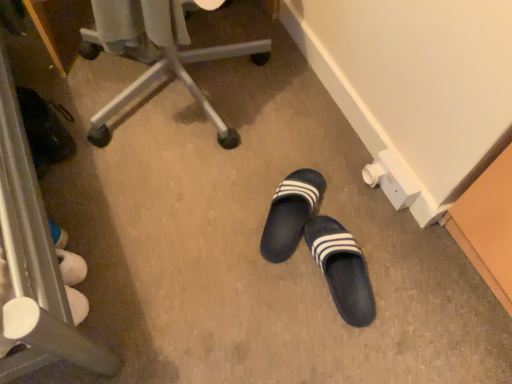
Question: Is black rubber slippers at center, the 1th footwear when ordered from left to right, not near black rubber slippers at center, the 2th footwear positioned from the left?

Choices:
 (A) no
 (B) yes

Answer: (A)

Question: Is black rubber slippers at center, the second footwear in the right-to-left sequence, closer to camera compared to black rubber slippers at center, the 1th footwear when ordered from right to left?

Choices:
 (A) no
 (B) yes

Answer: (A)

Question: Is black rubber slippers at center, the second footwear in the right-to-left sequence, wider than black rubber slippers at center, the 1th footwear when ordered from right to left?

Choices:
 (A) yes
 (B) no

Answer: (A)

Question: From a real-world perspective, is black rubber slippers at center, the second footwear in the right-to-left sequence, over black rubber slippers at center, the 1th footwear when ordered from right to left?

Choices:
 (A) no
 (B) yes

Answer: (B)

Question: From a real-world perspective, is black rubber slippers at center, the second footwear in the right-to-left sequence, located beneath black rubber slippers at center, the 1th footwear when ordered from right to left?

Choices:
 (A) yes
 (B) no

Answer: (B)

Question: In terms of width, does black rubber slippers at center, the 2th footwear positioned from the left, look wider or thinner when compared to matte plastic chair at upper center?

Choices:
 (A) wide
 (B) thin

Answer: (B)

Question: Choose the correct answer: Is black rubber slippers at center, the 2th footwear positioned from the left, inside matte plastic chair at upper center or outside it?

Choices:
 (A) outside
 (B) inside

Answer: (A)

Question: Considering the positions of black rubber slippers at center, the 2th footwear positioned from the left, and matte plastic chair at upper center in the image, is black rubber slippers at center, the 2th footwear positioned from the left, bigger or smaller than matte plastic chair at upper center?

Choices:
 (A) small
 (B) big

Answer: (A)

Question: Considering the relative positions of black rubber slippers at center, the 1th footwear when ordered from right to left, and matte plastic chair at upper center in the image provided, is black rubber slippers at center, the 1th footwear when ordered from right to left, to the left or to the right of matte plastic chair at upper center?

Choices:
 (A) right
 (B) left

Answer: (A)

Question: From a real-world perspective, is black rubber slippers at center, the second footwear in the right-to-left sequence, positioned above or below matte plastic chair at upper center?

Choices:
 (A) below
 (B) above

Answer: (A)

Question: From the image's perspective, is black rubber slippers at center, the 1th footwear when ordered from left to right, above or below matte plastic chair at upper center?

Choices:
 (A) above
 (B) below

Answer: (B)

Question: Based on their sizes in the image, would you say black rubber slippers at center, the 1th footwear when ordered from left to right, is bigger or smaller than matte plastic chair at upper center?

Choices:
 (A) small
 (B) big

Answer: (A)

Question: Is point (266, 226) closer or farther from the camera than point (174, 49)?

Choices:
 (A) closer
 (B) farther

Answer: (A)

Question: Is matte plastic chair at upper center bigger or smaller than black rubber slippers at center, the 1th footwear when ordered from left to right?

Choices:
 (A) big
 (B) small

Answer: (A)

Question: Is point (143, 11) closer or farther from the camera than point (297, 180)?

Choices:
 (A) farther
 (B) closer

Answer: (B)